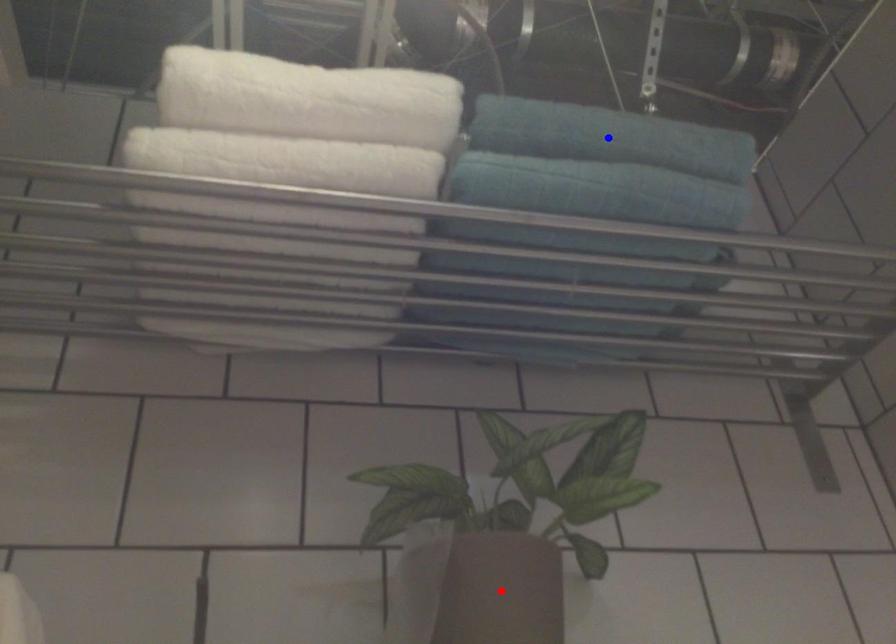
Question: Which of the two points in the image is closer to the camera?

Choices:
 (A) Blue point is closer.
 (B) Red point is closer.

Answer: (B)